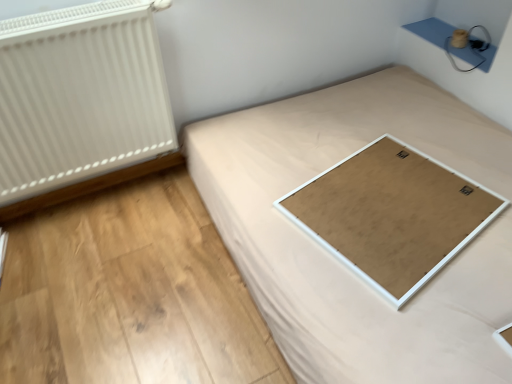
The height and width of the screenshot is (384, 512). I want to click on vacant space situated above natural wood plywood at lower center (from a real-world perspective), so click(x=129, y=281).